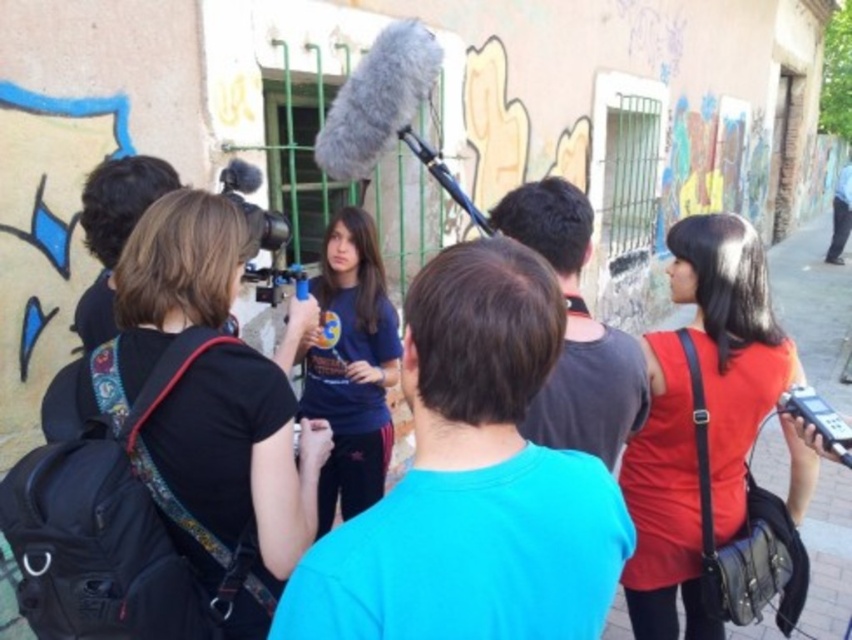
Between point (358, 410) and point (250, 248), which one is positioned in front?

Positioned in front is point (250, 248).

How far apart are matte blue t-shirt at center and matte black video camera at center?

matte blue t-shirt at center and matte black video camera at center are 25.37 inches apart from each other.

Measure the distance between point (x=338, y=352) and camera.

The distance of point (x=338, y=352) from camera is 3.20 meters.

Where is `matte blue t-shirt at center`? The height and width of the screenshot is (640, 852). matte blue t-shirt at center is located at coordinates (350, 365).

Between point (262, 499) and point (346, 273), which one is positioned behind?

Positioned behind is point (346, 273).

The width and height of the screenshot is (852, 640). Identify the location of matte black backpack at center. point(237,470).

Where is `matte black backpack at center`? The width and height of the screenshot is (852, 640). matte black backpack at center is located at coordinates (237, 470).

Can you confirm if matte black backpack at center is positioned below matte black video camera at center?

Correct, matte black backpack at center is located below matte black video camera at center.

Who is shorter, matte black backpack at center or matte black video camera at center?

matte black video camera at center

Between point (160, 269) and point (245, 186), which one is positioned behind?

The point (245, 186) is more distant.

This screenshot has width=852, height=640. I want to click on matte black backpack at center, so click(237, 470).